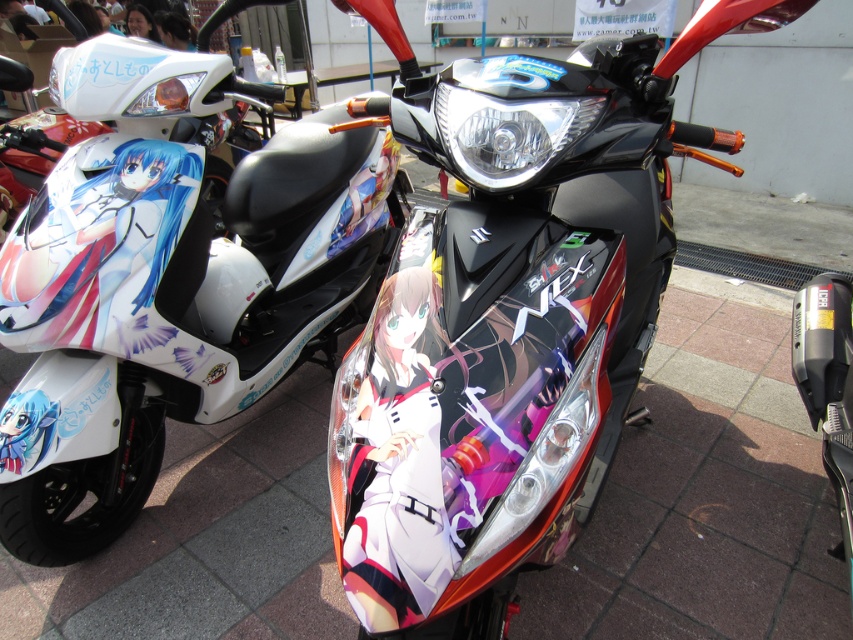
Question: Can you confirm if glossy black motorcycle at center is positioned below white glossy scooter at left?

Choices:
 (A) no
 (B) yes

Answer: (B)

Question: Is glossy black motorcycle at center behind white glossy scooter at left?

Choices:
 (A) no
 (B) yes

Answer: (A)

Question: Which object appears farthest from the camera in this image?

Choices:
 (A) glossy black motorcycle at center
 (B) white glossy scooter at left

Answer: (B)

Question: Can you confirm if glossy black motorcycle at center is positioned to the right of white glossy scooter at left?

Choices:
 (A) no
 (B) yes

Answer: (B)